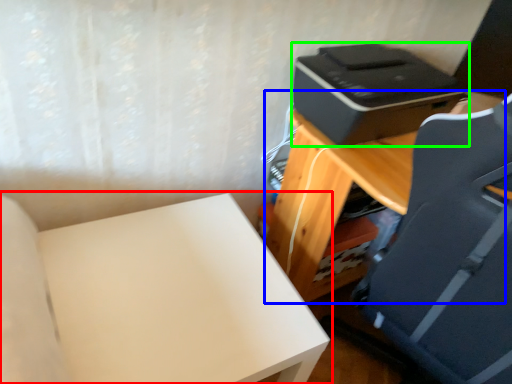
Question: Which is farther away from furniture (highlighted by a red box)? table (highlighted by a blue box) or printer (highlighted by a green box)?

Choices:
 (A) table
 (B) printer

Answer: (B)